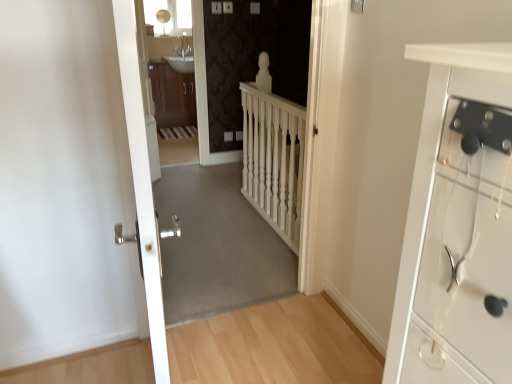
Question: Can you confirm if white plastic electric outlet at center is shorter than wooden cabinet at center?

Choices:
 (A) no
 (B) yes

Answer: (B)

Question: Considering the relative positions of white plastic electric outlet at center and wooden cabinet at center in the image provided, is white plastic electric outlet at center behind wooden cabinet at center?

Choices:
 (A) no
 (B) yes

Answer: (A)

Question: From a real-world perspective, does white plastic electric outlet at center sit lower than wooden cabinet at center?

Choices:
 (A) yes
 (B) no

Answer: (A)

Question: Considering the relative sizes of white plastic electric outlet at center and wooden cabinet at center in the image provided, is white plastic electric outlet at center wider than wooden cabinet at center?

Choices:
 (A) yes
 (B) no

Answer: (B)

Question: From a real-world perspective, is white plastic electric outlet at center located higher than wooden cabinet at center?

Choices:
 (A) yes
 (B) no

Answer: (B)

Question: Is white metallic door at center spatially inside carpeted corridor at center, which is the 2th corridor from top to bottom, or outside of it?

Choices:
 (A) outside
 (B) inside

Answer: (A)

Question: Considering the positions of point (136, 183) and point (166, 205), is point (136, 183) closer or farther from the camera than point (166, 205)?

Choices:
 (A) closer
 (B) farther

Answer: (A)

Question: From the image's perspective, relative to carpeted corridor at center, which ranks as the first corridor in bottom-to-top order, is white metallic door at center above or below?

Choices:
 (A) below
 (B) above

Answer: (B)

Question: Considering the positions of white metallic door at center and carpeted corridor at center, which ranks as the first corridor in bottom-to-top order, in the image, is white metallic door at center bigger or smaller than carpeted corridor at center, which ranks as the first corridor in bottom-to-top order,?

Choices:
 (A) small
 (B) big

Answer: (B)

Question: In the image, is white metallic door at center positioned in front of or behind wooden cabinet at center?

Choices:
 (A) behind
 (B) front

Answer: (B)

Question: Considering the positions of white metallic door at center and wooden cabinet at center in the image, is white metallic door at center wider or thinner than wooden cabinet at center?

Choices:
 (A) thin
 (B) wide

Answer: (A)

Question: Is white metallic door at center bigger or smaller than wooden cabinet at center?

Choices:
 (A) small
 (B) big

Answer: (A)

Question: Is point (141, 110) closer or farther from the camera than point (176, 76)?

Choices:
 (A) closer
 (B) farther

Answer: (A)

Question: Looking at the image, does white textured stairwell at center seem bigger or smaller compared to wooden cabinet at center?

Choices:
 (A) big
 (B) small

Answer: (B)

Question: Looking at their shapes, would you say white textured stairwell at center is wider or thinner than wooden cabinet at center?

Choices:
 (A) wide
 (B) thin

Answer: (A)